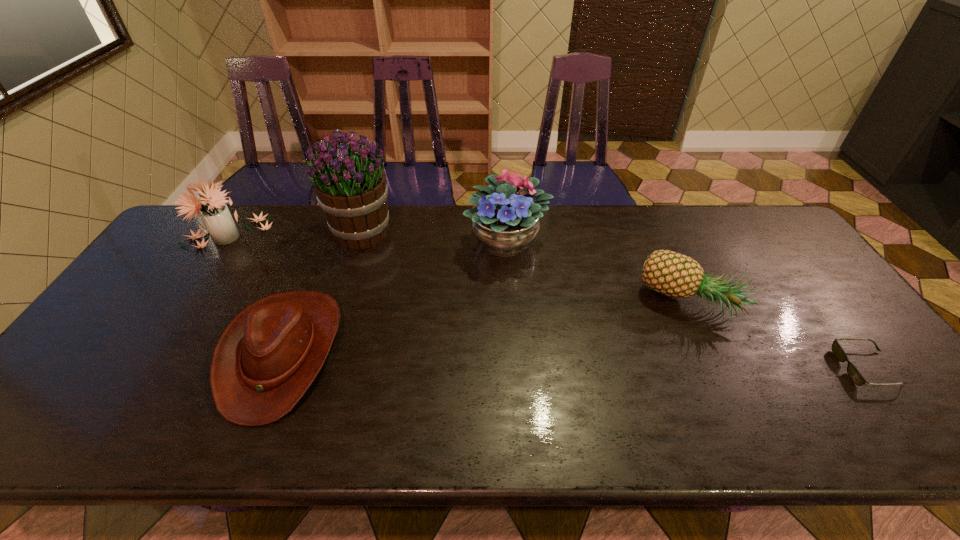
At what (x,y) coordinates should I click in order to perform the action: click on free space at the far edge of the desktop. Please return your answer as a coordinate pair (x, y). This screenshot has height=540, width=960. Looking at the image, I should click on (417, 222).

This screenshot has height=540, width=960. In the image, there is a desktop. What are the coordinates of `blank space at the near edge` in the screenshot? It's located at (242, 439).

In order to click on vacant area at the left edge in this screenshot , I will do `click(160, 254)`.

Find the location of a particular element. free location at the right edge of the desktop is located at coordinates (829, 371).

Locate an element on the screen. This screenshot has height=540, width=960. vacant area at the far right corner is located at coordinates (728, 206).

Identify the location of vacant space in between the cowboy hat and the rightmost object. The image size is (960, 540). (574, 360).

Where is `vacant area that lies between the fourth object from left to right and the pineapple`? vacant area that lies between the fourth object from left to right and the pineapple is located at coordinates (598, 272).

At what (x,y) coordinates should I click in order to perform the action: click on empty space between the pineapple and the leftmost object. Please return your answer as a coordinate pair (x, y). This screenshot has width=960, height=540. Looking at the image, I should click on (459, 269).

What are the coordinates of `free spot between the third object from right to left and the shortest object` in the screenshot? It's located at (686, 305).

This screenshot has width=960, height=540. What are the coordinates of `vacant space that's between the second bouquet from left to right and the leftmost object` in the screenshot? It's located at (295, 233).